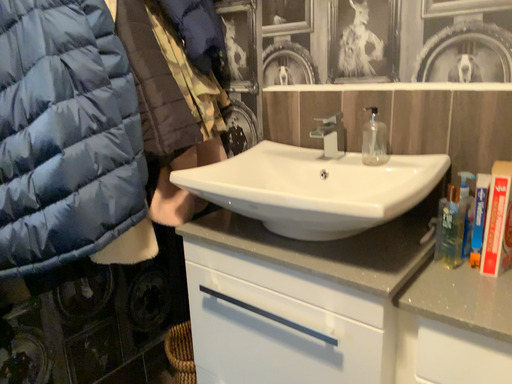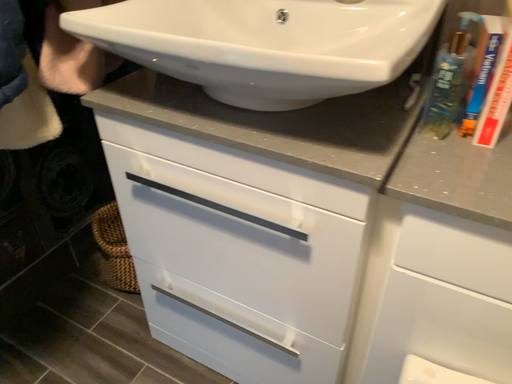
Question: Which way did the camera rotate in the video?

Choices:
 (A) rotated downward
 (B) rotated upward

Answer: (A)